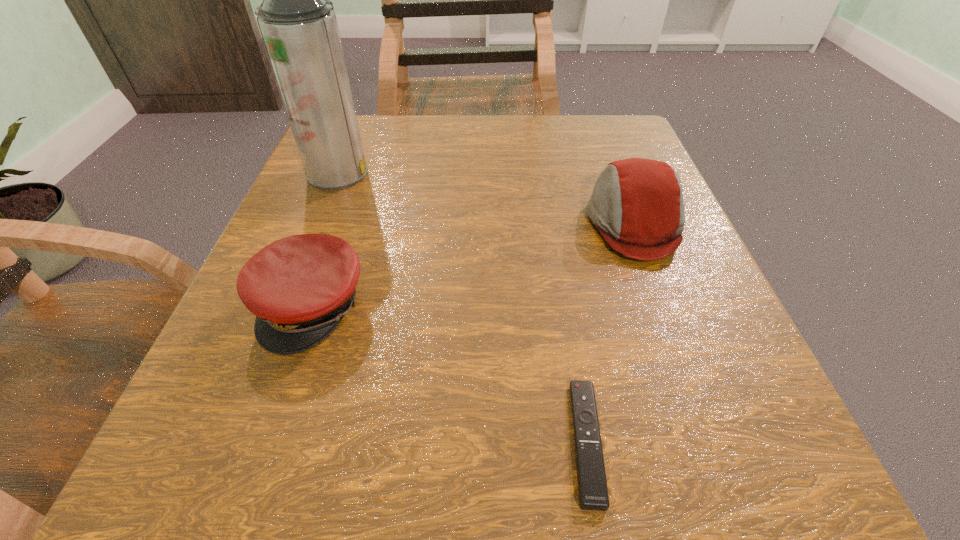
What are the coordinates of `free spot located 0.070m on the front-facing side of the rightmost object` in the screenshot? It's located at (545, 223).

The width and height of the screenshot is (960, 540). I want to click on free space located on the front of the left cap with an emblem, so click(x=247, y=498).

In order to click on vacant region located 0.290m on the left of the shortest object in this screenshot , I will do pos(304,441).

Locate an element on the screen. This screenshot has height=540, width=960. object located at the far edge is located at coordinates (298, 24).

Where is `object that is at the near edge`? This screenshot has height=540, width=960. object that is at the near edge is located at coordinates (592, 485).

Image resolution: width=960 pixels, height=540 pixels. I want to click on aerosol can situated at the left edge, so click(x=298, y=24).

Find the location of a particular element. This screenshot has width=960, height=540. cap that is positioned at the left edge is located at coordinates (300, 287).

Find the location of `object at the right edge`. object at the right edge is located at coordinates (637, 204).

Where is `object at the far left corner`? This screenshot has height=540, width=960. object at the far left corner is located at coordinates pyautogui.click(x=298, y=24).

In the image, there is a desktop. Find the location of `free space at the far edge`. free space at the far edge is located at coordinates [x=519, y=143].